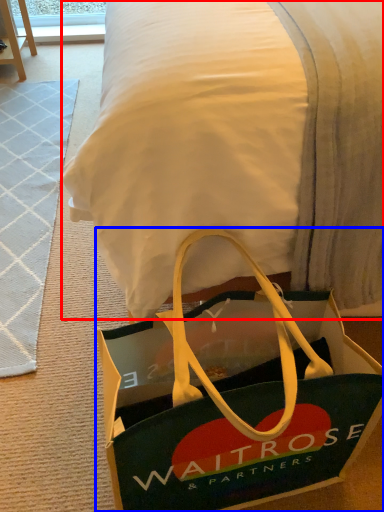
Question: Which object appears farthest to the camera in this image, blanket (highlighted by a red box) or handbag (highlighted by a blue box)?

Choices:
 (A) blanket
 (B) handbag

Answer: (B)